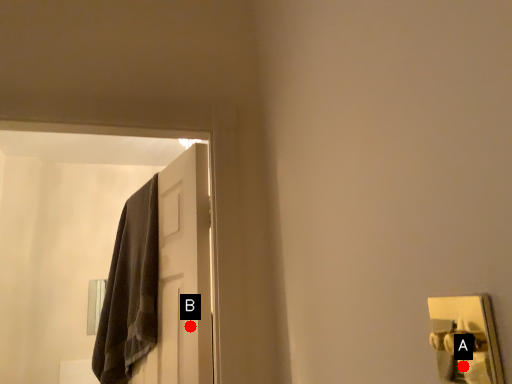
Question: Two points are circled on the image, labeled by A and B beside each circle. Which point is closer to the camera?

Choices:
 (A) A is closer
 (B) B is closer

Answer: (B)